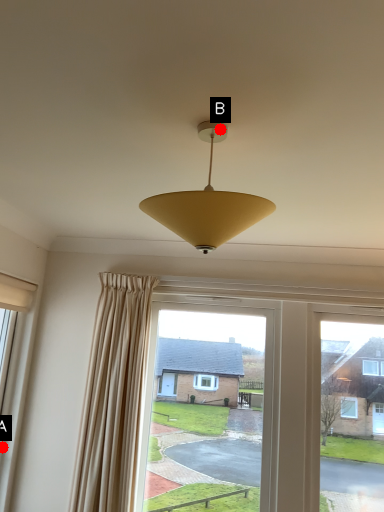
Question: Two points are circled on the image, labeled by A and B beside each circle. Which point appears farthest from the camera in this image?

Choices:
 (A) A is further
 (B) B is further

Answer: (A)